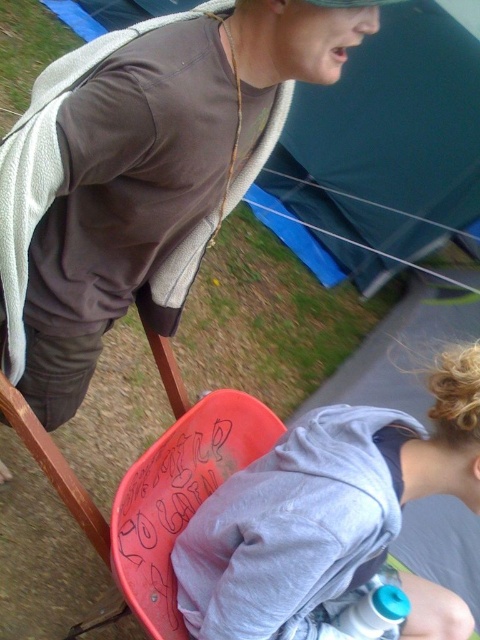
You are standing in the outdoor scene and want to place a small plant between the two points, point (469, 394) and point (388, 589). To ensure it is visible to both people, should you place it closer to which point?

Place the small plant closer to point (469, 394) because it is closer to the viewer, making it visible to both individuals.

You are a photographer setting up a shot of the two people in the scene. You want to ensure the gray cotton hoodie at lower right and the blue translucent bottle at lower center are both in focus. Which object should you focus on first to ensure depth of field captures both?

The gray cotton hoodie at lower right is above the blue translucent bottle at lower center, so focusing on the gray cotton hoodie at lower right first will ensure the depth of field captures both objects since it is closer to the camera.

You are a photographer setting up a shoot in this scene. You need to position a light source so that it illuminates both the matte brown hoodie at upper left and the gray cotton hoodie at lower right without casting harsh shadows. Based on their positions, where should you place the light source relative to these two hoodies?

The matte brown hoodie at upper left is located above the gray cotton hoodie at lower right. To illuminate both without harsh shadows, place the light source above and between the two hoodies, ensuring even lighting from above.